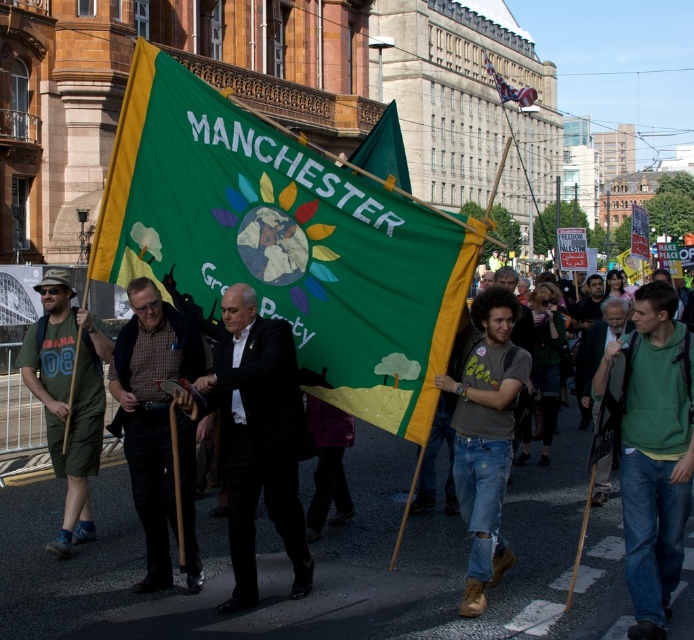
Question: Can you confirm if green fabric flag at center is positioned to the left of green cotton hoodie at lower right?

Choices:
 (A) yes
 (B) no

Answer: (A)

Question: Does brown checkered shirt at center have a lesser width compared to green fabric sign at center?

Choices:
 (A) no
 (B) yes

Answer: (A)

Question: Is green fabric flag at center further to the viewer compared to green cotton hoodie at lower right?

Choices:
 (A) yes
 (B) no

Answer: (A)

Question: Which of the following is the closest to the observer?

Choices:
 (A) (623, 464)
 (B) (178, 420)
 (C) (584, 401)
 (D) (46, 420)

Answer: (A)

Question: Which point is farther to the camera?

Choices:
 (A) (441, 321)
 (B) (153, 381)

Answer: (B)

Question: Which of the following is the farthest from the observer?

Choices:
 (A) (496, 88)
 (B) (84, 388)
 (C) (602, 333)
 (D) (153, 291)

Answer: (A)